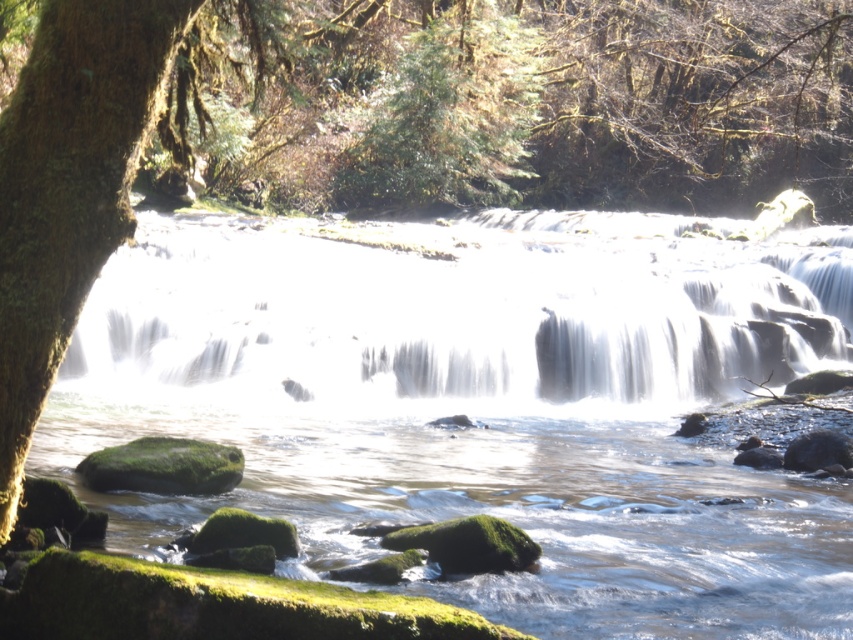
Question: Can you confirm if clear water at center is smaller than white frothy water at center?

Choices:
 (A) no
 (B) yes

Answer: (A)

Question: Among these objects, which one is farthest from the camera?

Choices:
 (A) clear water at center
 (B) green textured tree at upper center
 (C) white frothy water at center

Answer: (B)

Question: Does white frothy water at center appear on the left side of green mossy tree trunk at left?

Choices:
 (A) no
 (B) yes

Answer: (A)

Question: Which point is farther from the camera taking this photo?

Choices:
 (A) (21, 97)
 (B) (749, 476)
 (C) (350, 352)
 (D) (483, 6)

Answer: (D)

Question: Which of the following is the farthest from the observer?

Choices:
 (A) (483, 211)
 (B) (62, 250)

Answer: (A)

Question: Can you confirm if green mossy tree trunk at left is positioned to the right of green textured tree at upper center?

Choices:
 (A) no
 (B) yes

Answer: (A)